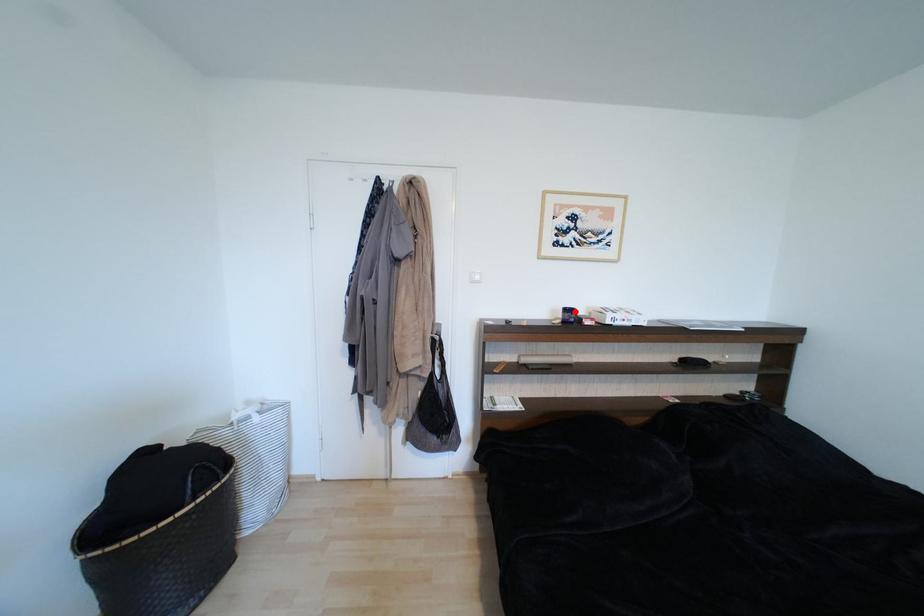
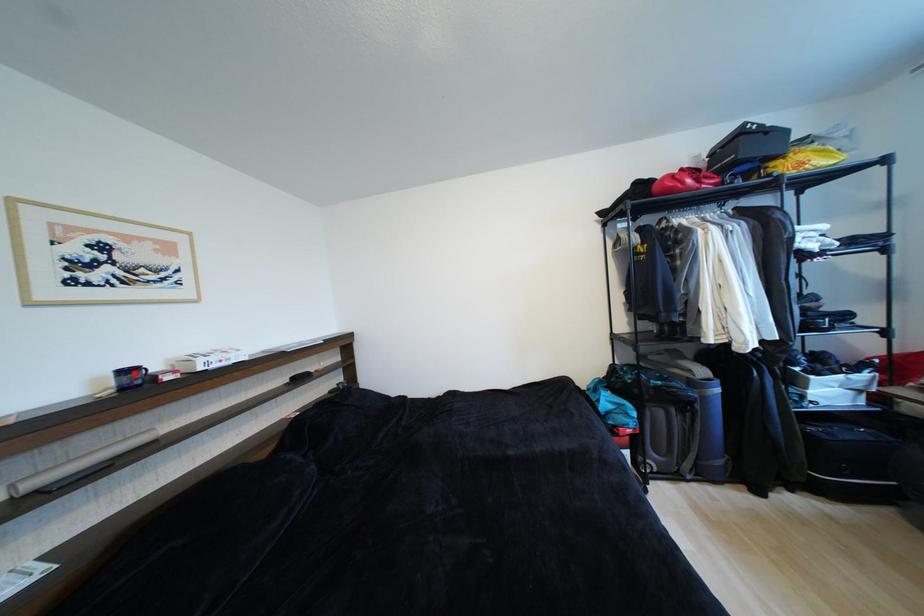
I am providing you with two images of the same scene from different viewpoints. A red point is marked on the first image and another point is marked on the second image. Do the highlighted points in image1 and image2 indicate the same real-world spot?

Yes